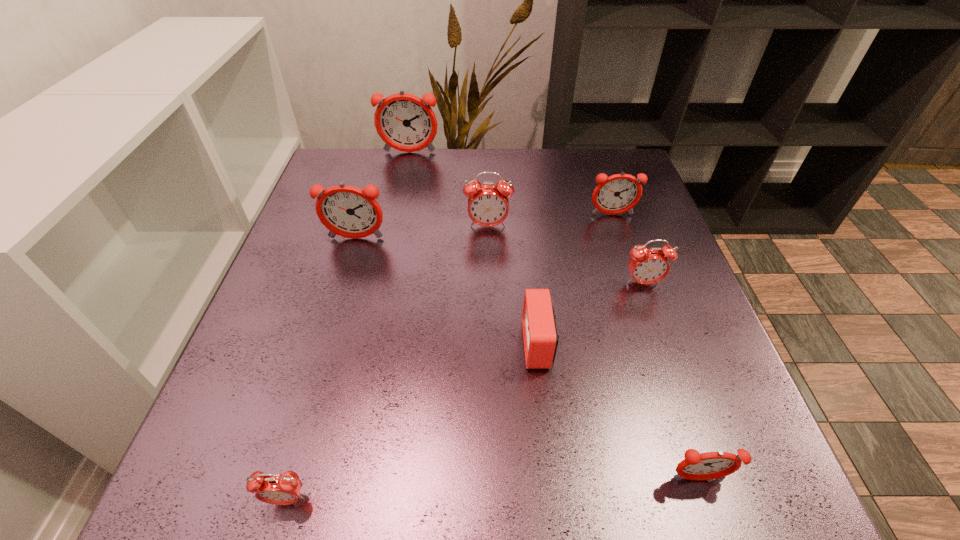
At what (x,y) coordinates should I click in order to perform the action: click on red alarm clock identified as the third closest to the second farthest object. Please return your answer as a coordinate pair (x, y). Looking at the image, I should click on pos(540,336).

Where is `blank space that satisfies the following two spatial constraints: 1. on the front-facing side of the second farthest object; 2. on the front-facing side of the sixth farthest alarm clock`? blank space that satisfies the following two spatial constraints: 1. on the front-facing side of the second farthest object; 2. on the front-facing side of the sixth farthest alarm clock is located at coordinates (656, 344).

You are a GUI agent. You are given a task and a screenshot of the screen. Output one action in this format:
    pyautogui.click(x=<x>, y=<y>)
    Task: Click on the free spot that satisfies the following two spatial constraints: 1. on the front-facing side of the third biggest reddish-pink alarm clock; 2. on the front-facing side of the third nearest alarm clock
    This screenshot has width=960, height=540.
    Given the screenshot: What is the action you would take?
    pyautogui.click(x=656, y=344)